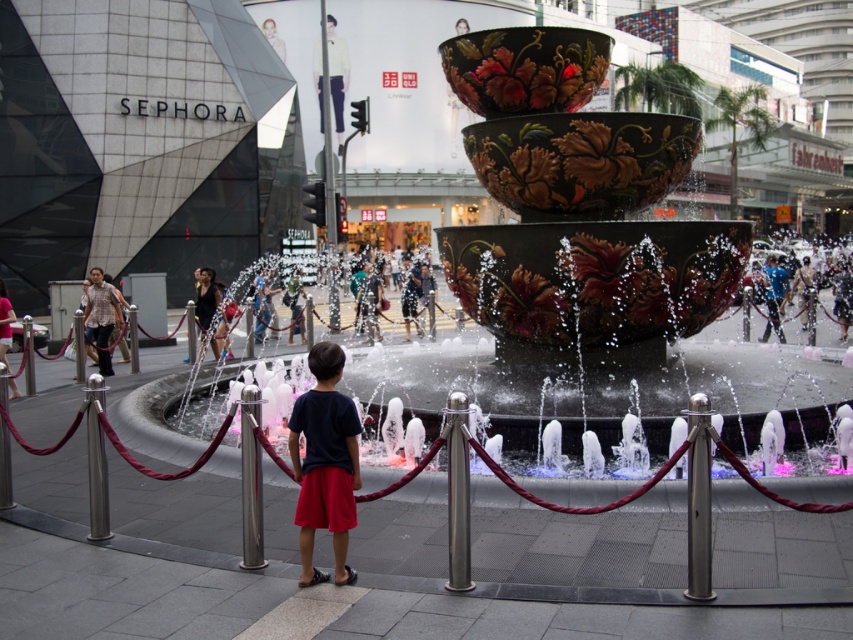
Who is taller, brushed metal pole at center or blue denim shorts at center?

brushed metal pole at center is taller.

Does brushed metal pole at center lie behind blue denim shorts at center?

No.

In order to click on brushed metal pole at center in this screenshot , I will do `click(251, 480)`.

At what (x,y) coordinates should I click in order to perform the action: click on brushed metal pole at center. Please return your answer as a coordinate pair (x, y). Looking at the image, I should click on (251, 480).

Can you confirm if painted ceramic bowls at center is taller than blue denim shorts at center?

Yes.

Does painted ceramic bowls at center have a lesser height compared to blue denim shorts at center?

Incorrect, painted ceramic bowls at center's height does not fall short of blue denim shorts at center's.

Who is more distant from viewer, (567, 49) or (267, 301)?

Point (267, 301)

In order to click on painted ceramic bowls at center in this screenshot , I will do `click(577, 209)`.

Is stainless steel post at center to the right of brushed metal pole at center from the viewer's perspective?

Indeed, stainless steel post at center is positioned on the right side of brushed metal pole at center.

Consider the image. Between stainless steel post at center and brushed metal pole at center, which one appears on the right side from the viewer's perspective?

Positioned to the right is stainless steel post at center.

Where is `stainless steel post at center`? This screenshot has width=853, height=640. stainless steel post at center is located at coordinates click(x=457, y=496).